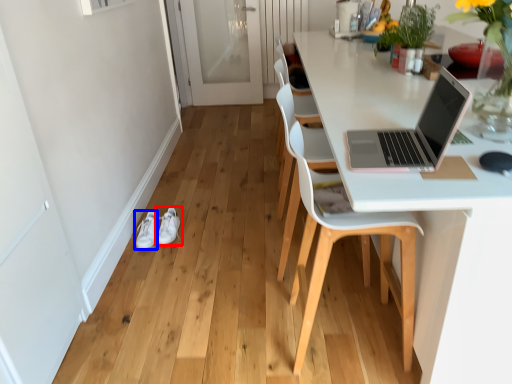
Question: Which of the following is the farthest to the observer, footwear (highlighted by a red box) or footwear (highlighted by a blue box)?

Choices:
 (A) footwear
 (B) footwear

Answer: (A)